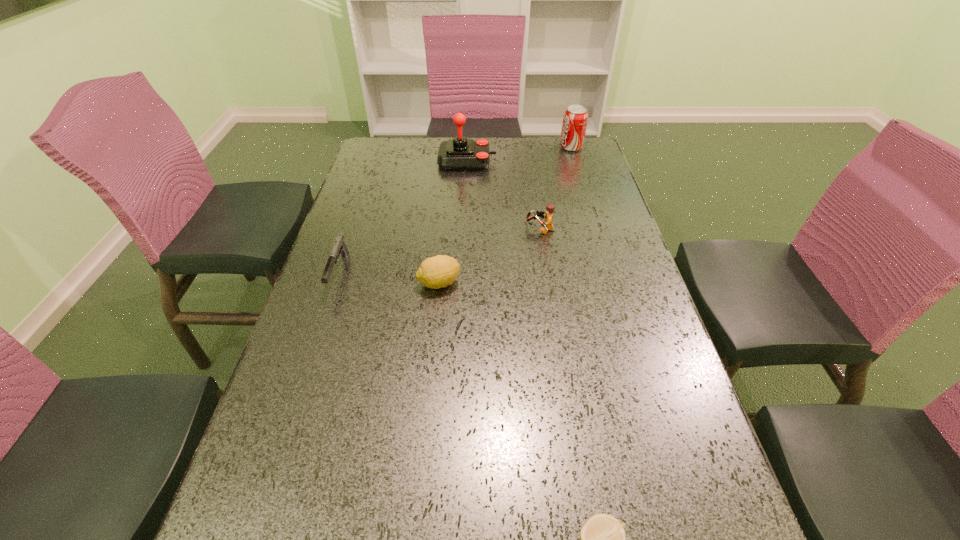
Image resolution: width=960 pixels, height=540 pixels. I want to click on vacant space at the far edge, so click(420, 146).

Where is `free space at the left edge of the desktop`? free space at the left edge of the desktop is located at coordinates (350, 246).

The image size is (960, 540). What are the coordinates of `free region at the right edge of the desktop` in the screenshot? It's located at (x=608, y=367).

In the image, there is a desktop. Identify the location of vacant region at the far right corner. The height and width of the screenshot is (540, 960). (554, 143).

Locate an element on the screen. This screenshot has width=960, height=540. free space between the left lemon and the tallest object is located at coordinates (453, 222).

You are a GUI agent. You are given a task and a screenshot of the screen. Output one action in this format:
    pyautogui.click(x=<x>, y=<y>)
    Task: Click on the free space between the taller lemon and the rightmost object
    
    Given the screenshot: What is the action you would take?
    pyautogui.click(x=505, y=215)

The width and height of the screenshot is (960, 540). I want to click on free space between the rightmost object and the Lego, so click(x=555, y=188).

Identify which object is the third nearest to the tallest object. Please provide its 2D coordinates. Your answer should be formatted as a tuple, i.e. [(x, y)], where the tuple contains the x and y coordinates of a point satisfying the conditions above.

[(339, 247)]

Select which object appears as the second closest to the fifth shortest object. Please provide its 2D coordinates. Your answer should be formatted as a tuple, i.e. [(x, y)], where the tuple contains the x and y coordinates of a point satisfying the conditions above.

[(547, 226)]

The image size is (960, 540). Find the location of `free space that satisfies the following two spatial constraints: 1. holding a crossbow in the hands of the third farthest object; 2. at the muzzle end of the leftmost object`. free space that satisfies the following two spatial constraints: 1. holding a crossbow in the hands of the third farthest object; 2. at the muzzle end of the leftmost object is located at coordinates (546, 272).